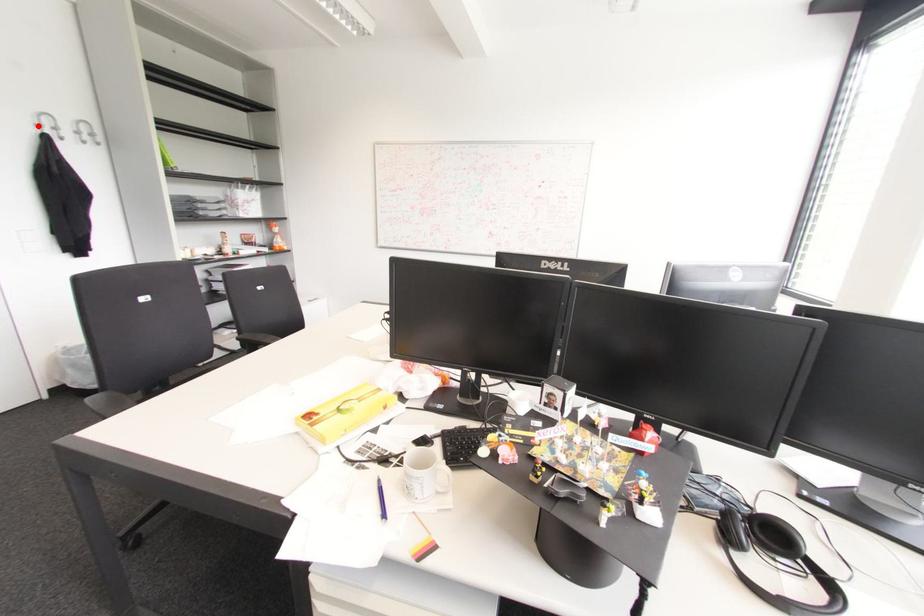
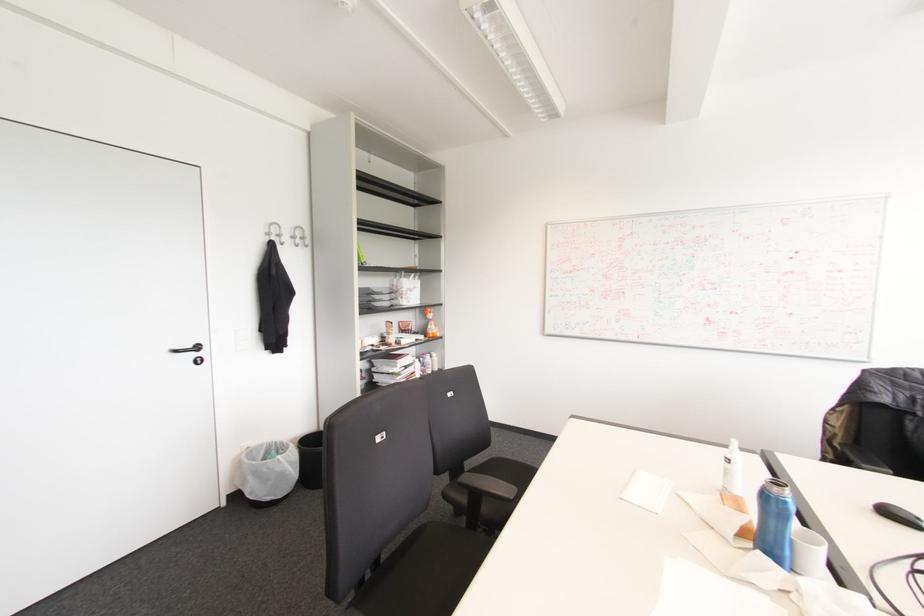
Question: I am providing you with two images of the same scene from different viewpoints. Image1 has a red point marked. In image2, the corresponding 3D location appears at what relative position? Reply with the corresponding letter.

Choices:
 (A) Closer
 (B) Farther

Answer: (A)